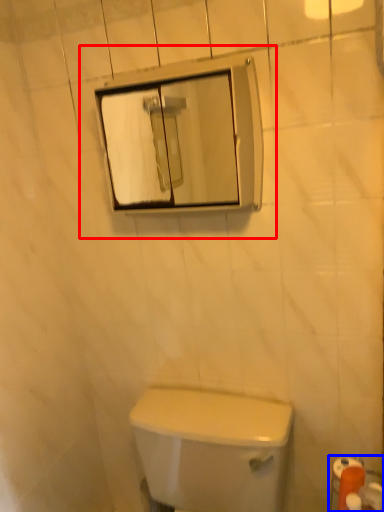
Question: Which object is closer to the camera taking this photo, view mirror (highlighted by a red box) or toilet paper (highlighted by a blue box)?

Choices:
 (A) view mirror
 (B) toilet paper

Answer: (A)